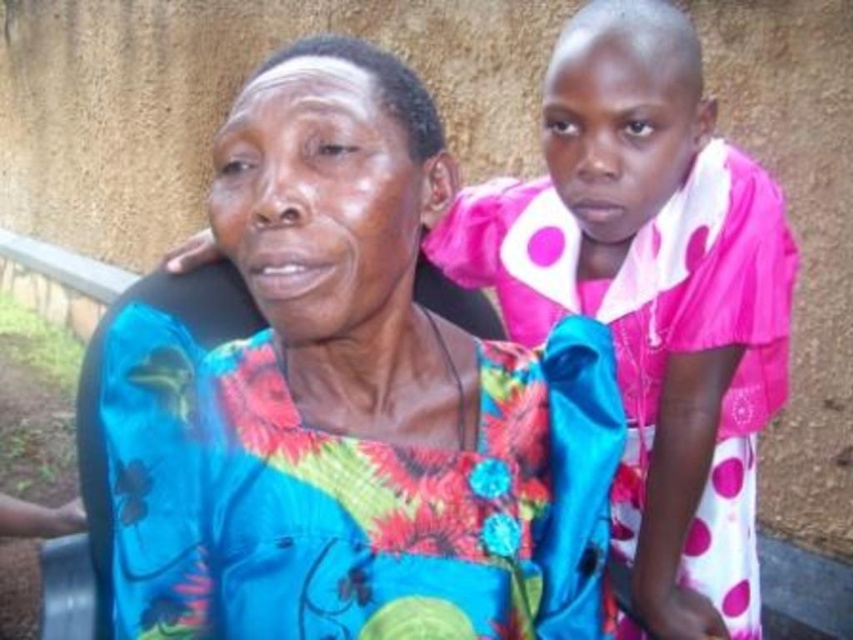
Does floral satin dress at center have a greater height compared to pink polka dot dress at upper right?

In fact, floral satin dress at center may be shorter than pink polka dot dress at upper right.

Which is above, floral satin dress at center or pink polka dot dress at upper right?

pink polka dot dress at upper right

Who is more distant from viewer, (141, 451) or (747, 614)?

Point (747, 614)

The height and width of the screenshot is (640, 853). In order to click on floral satin dress at center in this screenshot , I will do `click(354, 499)`.